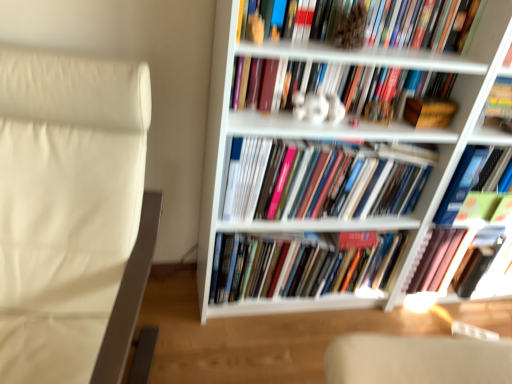
Question: Looking at their shapes, would you say white matte bookcase at upper right is wider or thinner than white leather rocking chair at left?

Choices:
 (A) thin
 (B) wide

Answer: (A)

Question: In terms of size, does white matte bookcase at upper right appear bigger or smaller than white leather rocking chair at left?

Choices:
 (A) big
 (B) small

Answer: (A)

Question: Considering the real-world distances, which object is closest to the hardcover book at center, the sixth book positioned from the top?

Choices:
 (A) white glossy statue at upper center, the second book positioned from the top
 (B) matte hardcover books at center, which is the fourth book from bottom to top
 (C) white leather rocking chair at left
 (D) wooden box at center-right
 (E) multicolored paperbacks at center, acting as the 2th book starting from the bottom

Answer: (B)

Question: Which of these objects is positioned closest to the white matte bookcase at upper right?

Choices:
 (A) hardcover book at upper center, the 6th book in the bottom-to-top sequence
 (B) white leather rocking chair at left
 (C) white glossy statue at upper center, the second book positioned from the top
 (D) hardcover book at center, the sixth book positioned from the top
 (E) wooden box at center-right

Answer: (C)